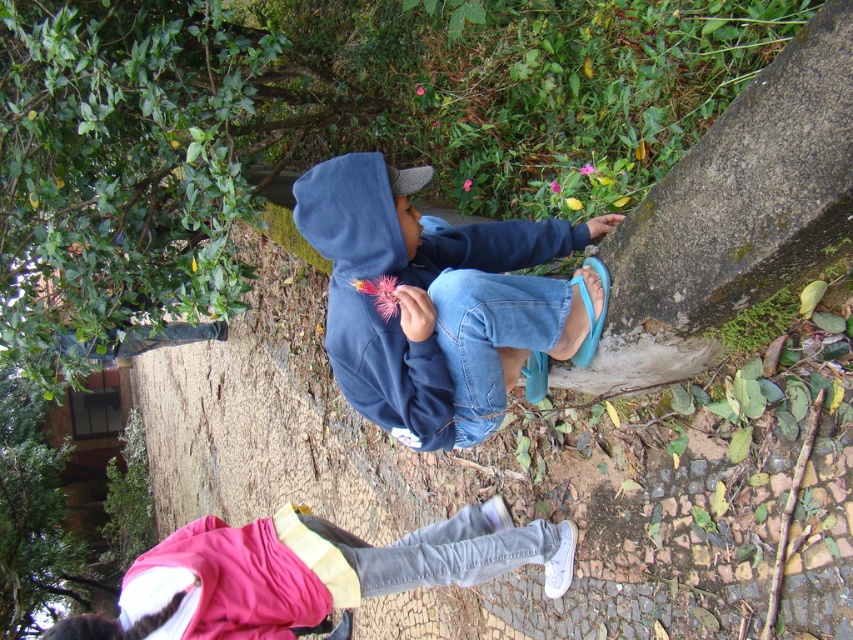
You are a photographer trying to capture a shot of the navy blue hoodie at center and the light blue denim jeans at lower center. Based on their positions, which object should you focus on first to ensure both are in the frame?

The navy blue hoodie at center is above the light blue denim jeans at lower center, so you should focus on the navy blue hoodie at center first to ensure both are in the frame.

You are standing at the point labeled point (540, 225) and want to walk to the point labeled point (463, 577). Which direction should you move to get closer to your destination?

You should move away from the camera because point (463, 577) is further from the camera than point (540, 225).

Consider the image. You are a parent trying to locate your child who is wearing a navy blue hoodie and light blue denim jeans in a garden. Based on the image provided, how far apart are the navy blue hoodie at center and the light blue denim jeans at lower center?

The navy blue hoodie at center and the light blue denim jeans at lower center are 36.91 inches apart from each other.